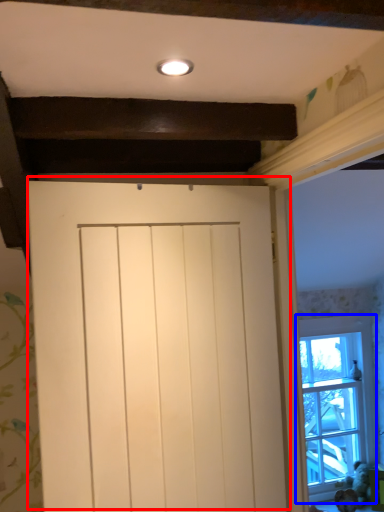
Question: Among these objects, which one is farthest to the camera, door (highlighted by a red box) or window (highlighted by a blue box)?

Choices:
 (A) door
 (B) window

Answer: (B)